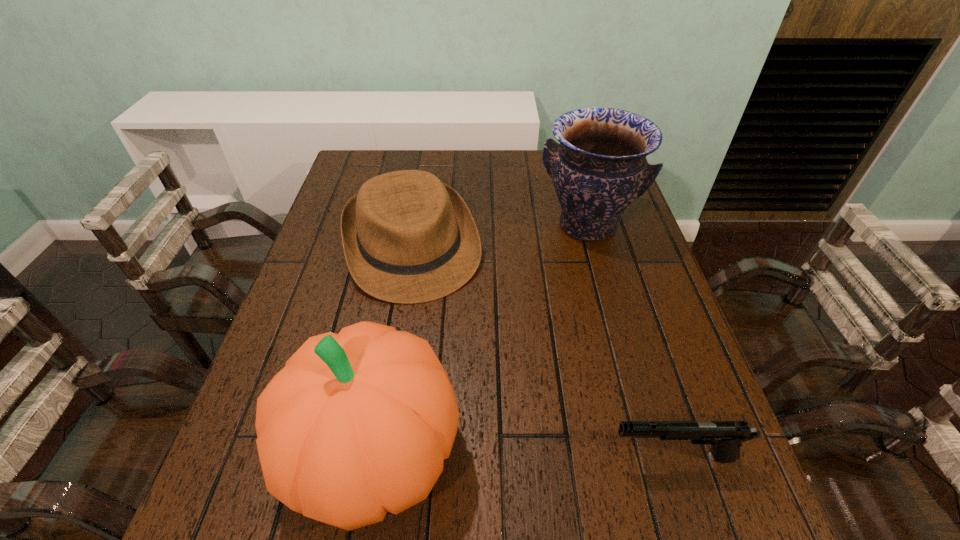
Where is `the shortest object`? Image resolution: width=960 pixels, height=540 pixels. the shortest object is located at coordinates (726, 437).

The width and height of the screenshot is (960, 540). In order to click on fedora in this screenshot , I will do `click(408, 238)`.

Where is `pottery`? Image resolution: width=960 pixels, height=540 pixels. pottery is located at coordinates (599, 168).

Find the location of a particular element. This screenshot has height=540, width=960. free space located at the aiming end of the gun is located at coordinates [x=444, y=456].

Locate an element on the screen. The image size is (960, 540). blank area located 0.290m at the aiming end of the gun is located at coordinates click(450, 456).

In order to click on blank space located at the aiming end of the gun in this screenshot , I will do `click(504, 456)`.

You are a GUI agent. You are given a task and a screenshot of the screen. Output one action in this format:
    pyautogui.click(x=<x>, y=<y>)
    Task: Click on the blank space located on the front-facing side of the third tallest object
    The height and width of the screenshot is (540, 960).
    Given the screenshot: What is the action you would take?
    pyautogui.click(x=436, y=329)

The height and width of the screenshot is (540, 960). In order to click on vacant space situated on the front-facing side of the third tallest object in this screenshot , I will do `click(444, 353)`.

The height and width of the screenshot is (540, 960). Find the location of `vacant region located on the front-facing side of the third tallest object`. vacant region located on the front-facing side of the third tallest object is located at coordinates (469, 436).

Find the location of a particular element. The image size is (960, 540). free location located 0.060m on the front handle of the pottery is located at coordinates (571, 268).